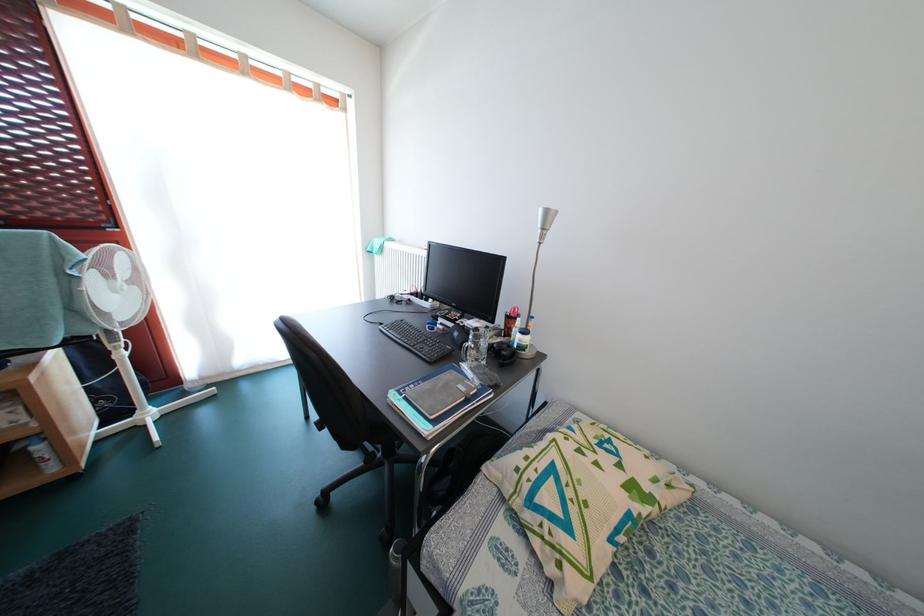
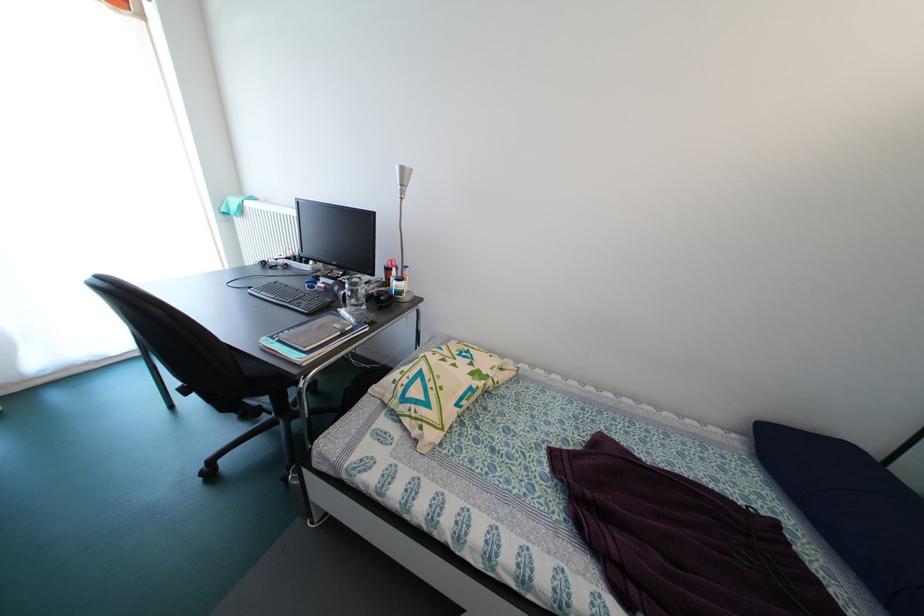
In the second image, find the point that corresponds to (x=492, y=350) in the first image.

(369, 297)